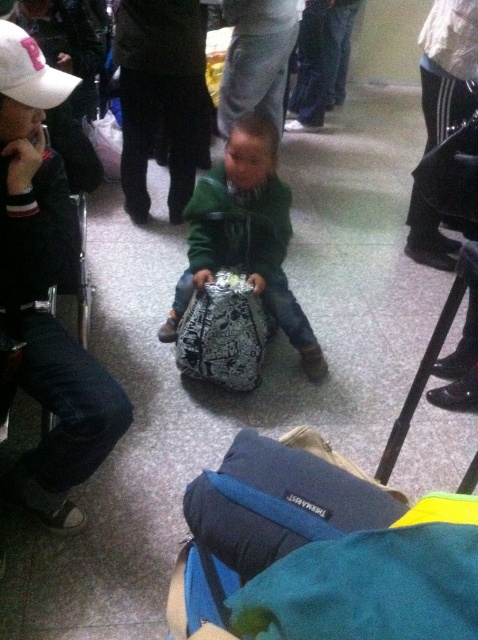
From the picture: You are standing at point (15, 67) and want to walk to point (226, 280). Is the destination point behind you or in front of you?

The destination point (226, 280) is behind point (15, 67), so it is behind you.

You are a parent looking for your child in a busy transit hub. You remember your child was wearing a green matte jacket at center and had a metallic silver bag at center. Based on the scene description, can you determine which item is closer to the floor?

The metallic silver bag at center is closer to the floor because the green matte jacket at center is located above it.